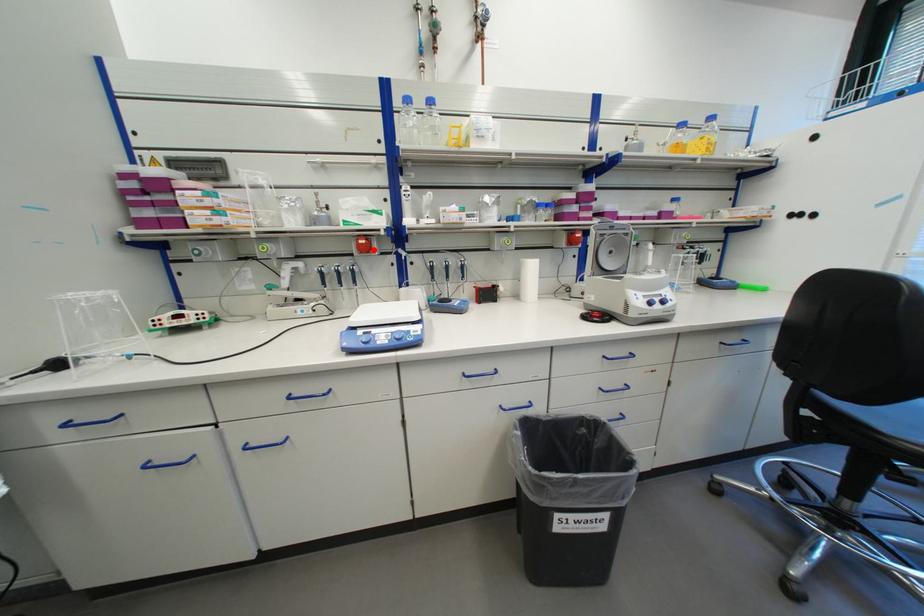
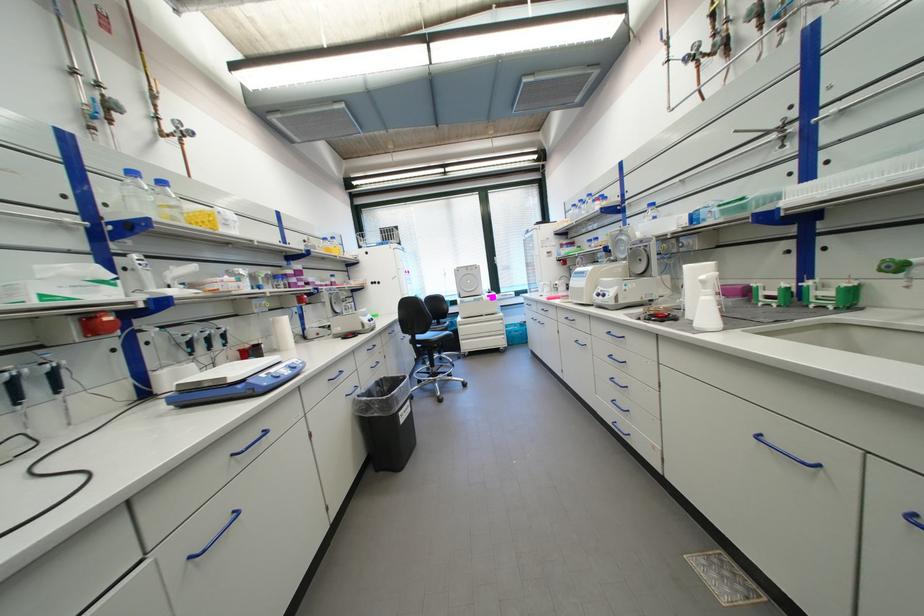
Locate, in the second image, the point that corresponds to the highlighted location in the first image.

(101, 331)